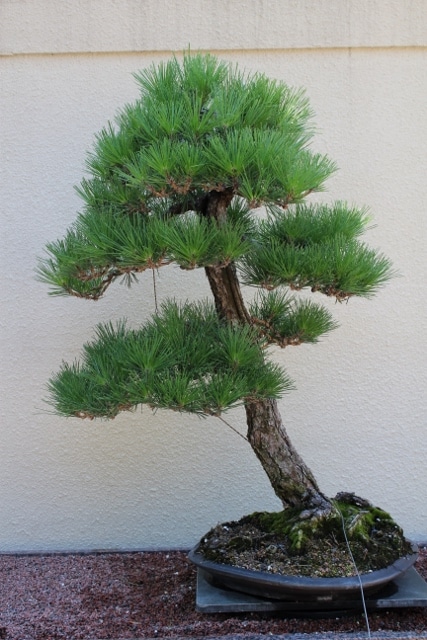
Image resolution: width=427 pixels, height=640 pixels. I want to click on wall, so click(x=77, y=500), click(x=353, y=401), click(x=41, y=337).